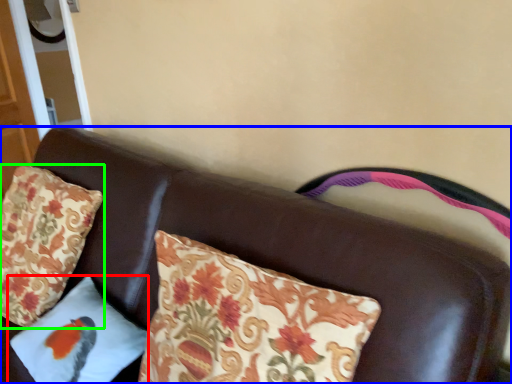
Question: Estimate the real-world distances between objects in this image. Which object is closer to pillow (highlighted by a red box), furniture (highlighted by a blue box) or pillow (highlighted by a green box)?

Choices:
 (A) furniture
 (B) pillow

Answer: (A)